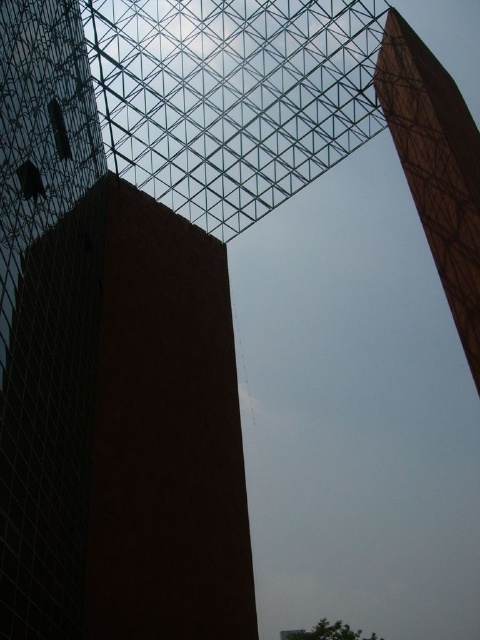
Looking at this image, which is more to the right, brown brick tower at center or wooden tower at upper right?

From the viewer's perspective, wooden tower at upper right appears more on the right side.

Does brown brick tower at center come in front of wooden tower at upper right?

Yes, brown brick tower at center is in front of wooden tower at upper right.

At what (x,y) coordinates should I click in order to perform the action: click on brown brick tower at center. Please return your answer as a coordinate pair (x, y). The width and height of the screenshot is (480, 640). Looking at the image, I should click on (122, 433).